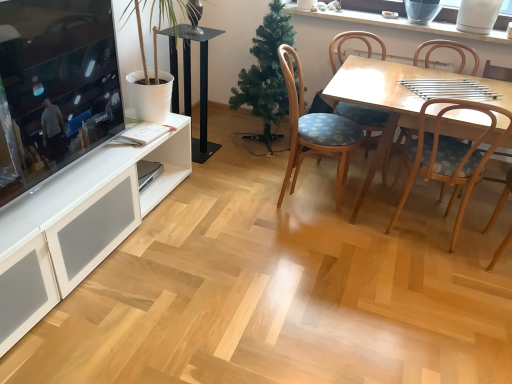
In order to click on vacant space to the left of light wood table at center in this screenshot , I will do `click(265, 216)`.